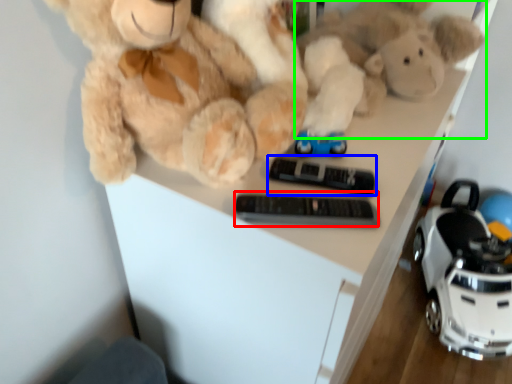
Question: Considering the real-world distances, which object is closest to control (highlighted by a red box)? control (highlighted by a blue box) or toy (highlighted by a green box).

Choices:
 (A) control
 (B) toy

Answer: (A)